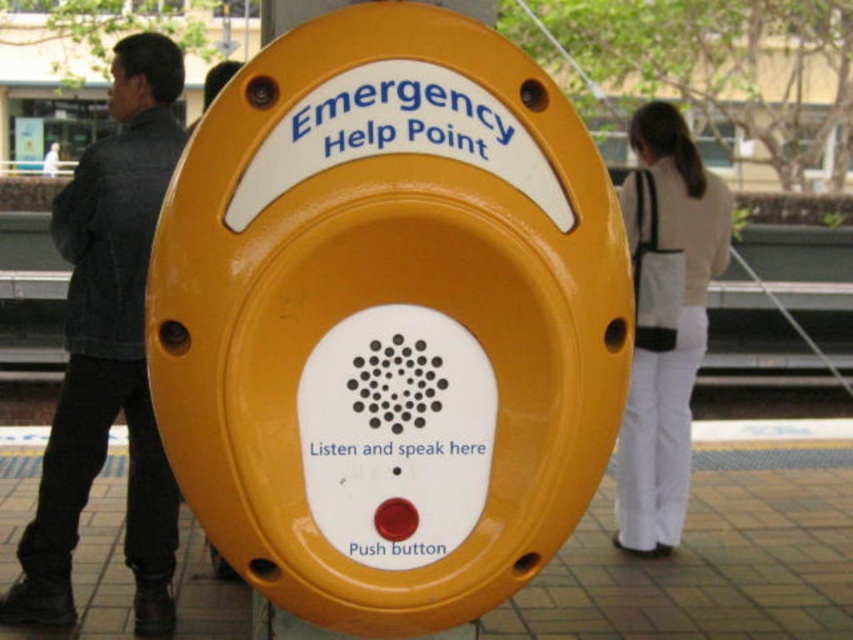
Consider the image. Can you confirm if dark gray denim jacket at left is positioned below white fabric bag at right?

No.

Is dark gray denim jacket at left bigger than white fabric bag at right?

Indeed, dark gray denim jacket at left has a larger size compared to white fabric bag at right.

Is point (148, 81) closer to camera compared to point (718, 236)?

That is True.

I want to click on dark gray denim jacket at left, so click(109, 349).